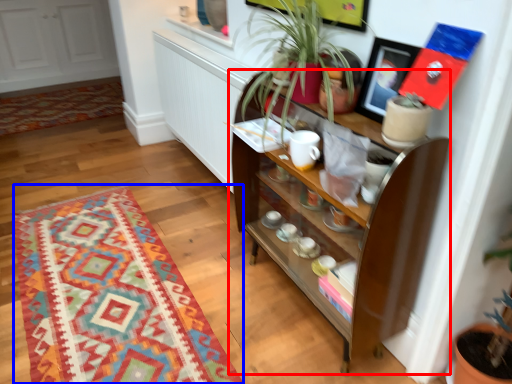
Question: Which of the following is the farthest to the observer, shelf (highlighted by a red box) or mat (highlighted by a blue box)?

Choices:
 (A) shelf
 (B) mat

Answer: (B)